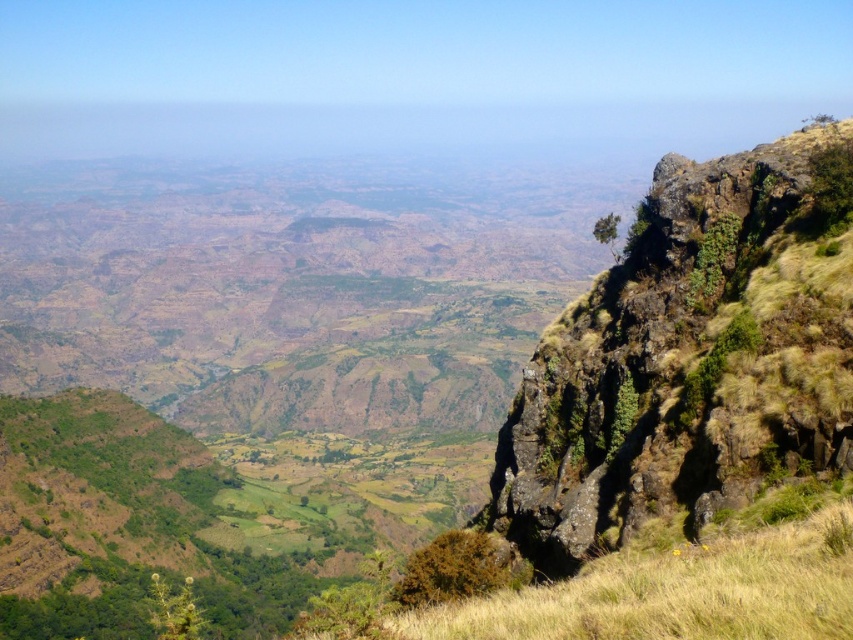
You are standing at the cliff edge and want to locate the yellow grassy at right. Where should you look relative to your position?

The yellow grassy at right is located at the lower right position relative to your viewpoint because its 2D coordinates are at point (683, 582), which places it in the lower right quadrant of the image.

You are standing at the cliff edge and want to look at the yellow grassy at right and the green leafy bush at lower right. Which one is nearer to you?

The yellow grassy at right is closer to the viewer than the green leafy bush at lower right.

You are standing at the cliff edge and see the yellow grassy at right and the green leafy bush at lower right. Which one is higher in elevation?

The yellow grassy at right is positioned over the green leafy bush at lower right, so it is higher in elevation.